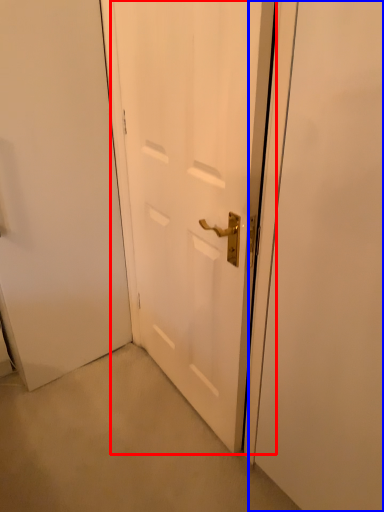
Question: Which point is further to the camera, door (highlighted by a red box) or screen door (highlighted by a blue box)?

Choices:
 (A) door
 (B) screen door

Answer: (A)